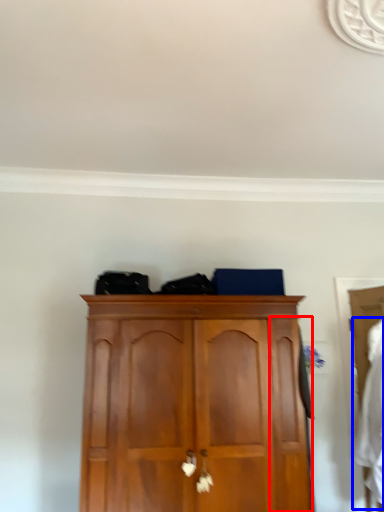
Question: Which point is closer to the camera, door (highlighted by a red box) or clothing (highlighted by a blue box)?

Choices:
 (A) door
 (B) clothing

Answer: (B)